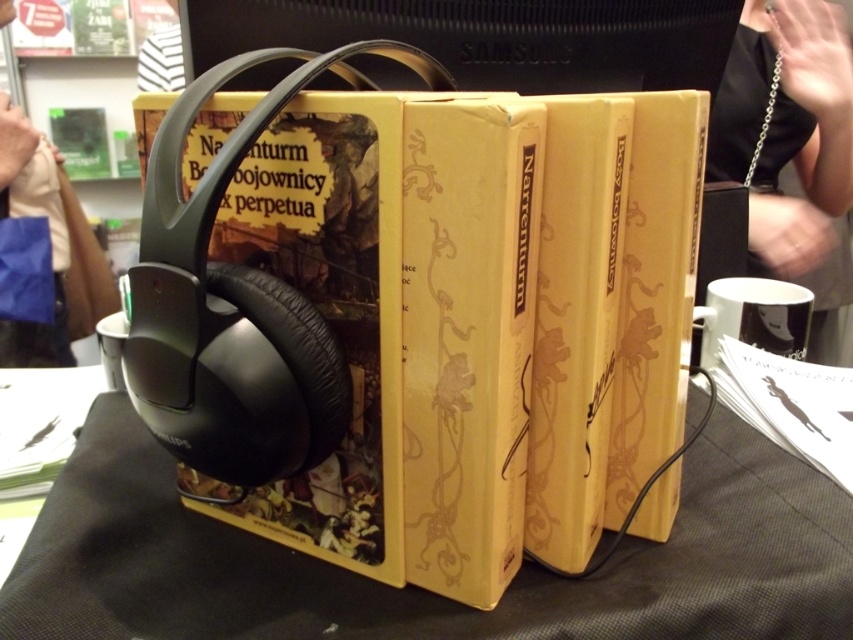
Who is lower down, black matte table at center or black leather handbag at upper right?

black matte table at center

Is black matte table at center positioned in front of black leather handbag at upper right?

That is True.

Measure the distance between black matte table at center and camera.

13.54 inches

The image size is (853, 640). In order to click on black matte table at center in this screenshot , I will do `click(416, 586)`.

Between yellow paperback book at center and black matte table at center, which one has less height?

With less height is black matte table at center.

Measure the distance between yellow paperback book at center and camera.

11.75 inches

Find the location of a particular element. The height and width of the screenshot is (640, 853). yellow paperback book at center is located at coordinates (541, 324).

Describe the element at coordinates (541, 324) in the screenshot. I see `yellow paperback book at center` at that location.

Is yellow paperback book at center taller than black leather handbag at upper right?

In fact, yellow paperback book at center may be shorter than black leather handbag at upper right.

Locate an element on the screen. yellow paperback book at center is located at coordinates (541, 324).